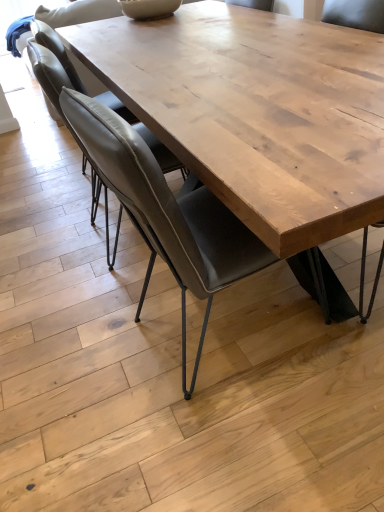
Question: From a real-world perspective, is leather-like gray chair at center, which ranks as the first chair in front-to-back order, positioned above or below leather at left, placed as the first chair when sorted from back to front?

Choices:
 (A) below
 (B) above

Answer: (A)

Question: From their relative heights in the image, would you say leather-like gray chair at center, which ranks as the first chair in front-to-back order, is taller or shorter than leather at left, the 2th chair when ordered from front to back?

Choices:
 (A) tall
 (B) short

Answer: (A)

Question: Considering the relative positions of leather-like gray chair at center, which ranks as the first chair in front-to-back order, and leather at left, placed as the first chair when sorted from back to front, in the image provided, is leather-like gray chair at center, which ranks as the first chair in front-to-back order, to the left or to the right of leather at left, placed as the first chair when sorted from back to front,?

Choices:
 (A) right
 (B) left

Answer: (A)

Question: From the image's perspective, is leather at left, the 2th chair when ordered from front to back, located above or below leather-like gray chair at center, which ranks as the first chair in front-to-back order?

Choices:
 (A) below
 (B) above

Answer: (B)

Question: From their relative heights in the image, would you say leather at left, placed as the first chair when sorted from back to front, is taller or shorter than leather-like gray chair at center, the 2th chair from the back?

Choices:
 (A) short
 (B) tall

Answer: (A)

Question: In terms of width, does leather at left, the 2th chair when ordered from front to back, look wider or thinner when compared to leather-like gray chair at center, which ranks as the first chair in front-to-back order?

Choices:
 (A) wide
 (B) thin

Answer: (B)

Question: Is leather at left, placed as the first chair when sorted from back to front, inside or outside of leather-like gray chair at center, the 2th chair from the back?

Choices:
 (A) outside
 (B) inside

Answer: (A)